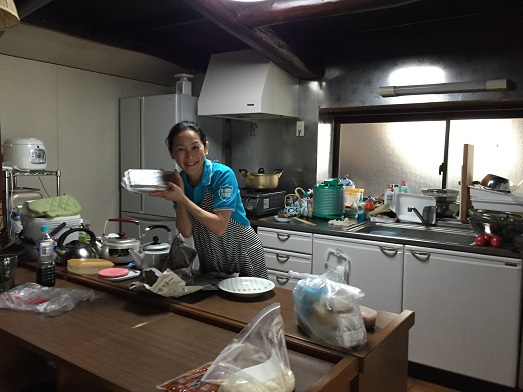
Locate an element on the screen. The image size is (523, 392). stove hood is located at coordinates 259,84.